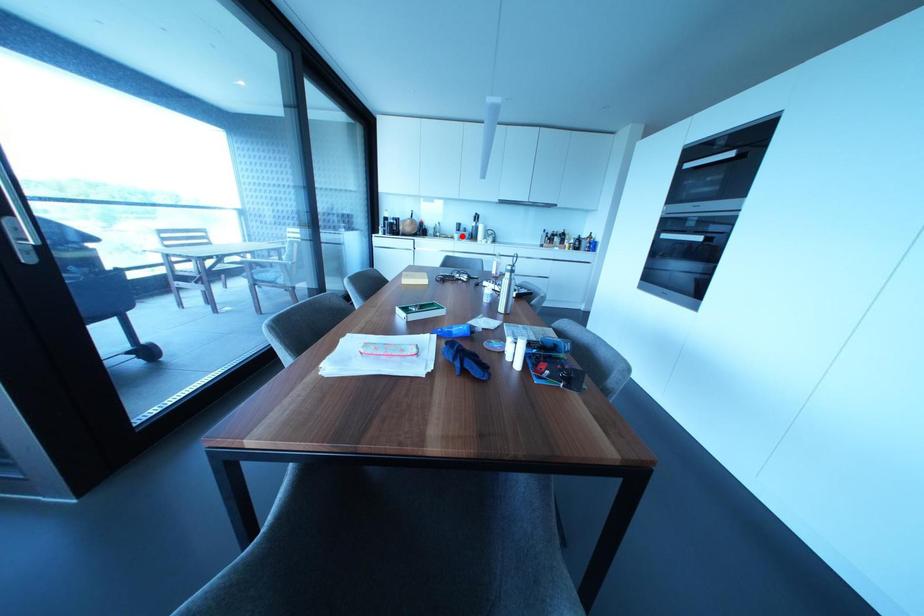
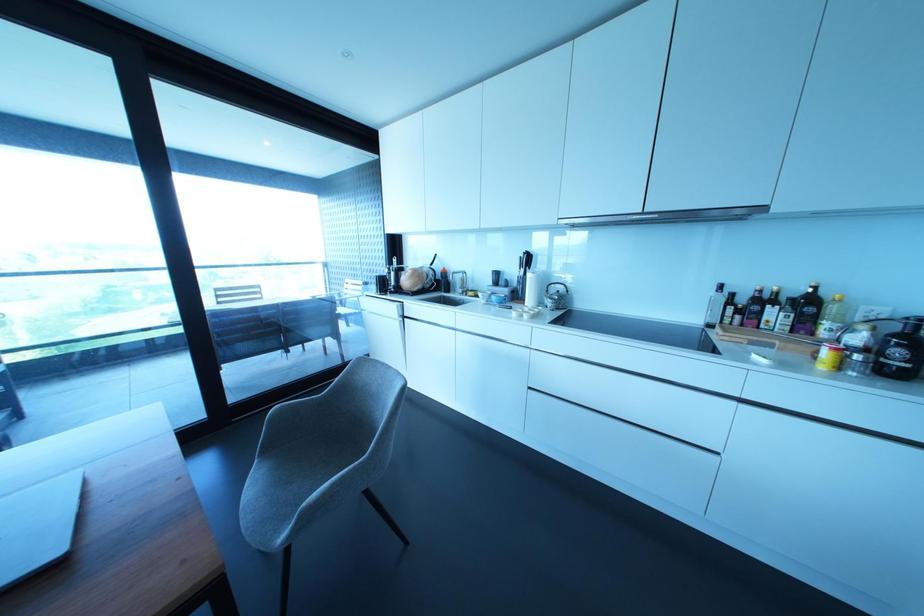
Find the pixel in the second image that matches the highlighted location in the first image.

(492, 297)